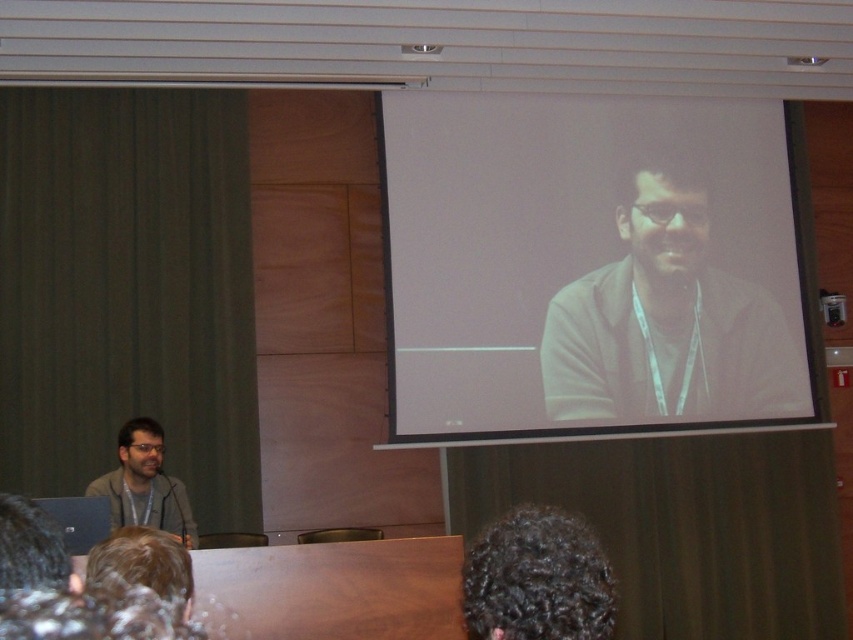
Which is more to the right, green fabric curtain at left or dark curly hair at lower center?

dark curly hair at lower center

Is the position of green fabric curtain at left more distant than that of dark curly hair at lower center?

Yes, green fabric curtain at left is further from the viewer.

Is point (180, 360) less distant than point (526, 627)?

No, it is not.

You are a GUI agent. You are given a task and a screenshot of the screen. Output one action in this format:
    pyautogui.click(x=<x>, y=<y>)
    Task: Click on the green fabric curtain at left
    The image size is (853, 640).
    Given the screenshot: What is the action you would take?
    click(x=126, y=291)

Can you confirm if white matte screen at upper center is wider than dark curly hair at lower center?

Correct, the width of white matte screen at upper center exceeds that of dark curly hair at lower center.

Is point (544, 145) less distant than point (541, 611)?

No, it is not.

The width and height of the screenshot is (853, 640). I want to click on white matte screen at upper center, so click(x=595, y=268).

Between green fabric curtain at left and matte brown jacket at upper right, which one is positioned lower?

Positioned lower is green fabric curtain at left.

Identify the location of green fabric curtain at left. The image size is (853, 640). (126, 291).

At what (x,y) coordinates should I click in order to perform the action: click on green fabric curtain at left. Please return your answer as a coordinate pair (x, y). Looking at the image, I should click on (126, 291).